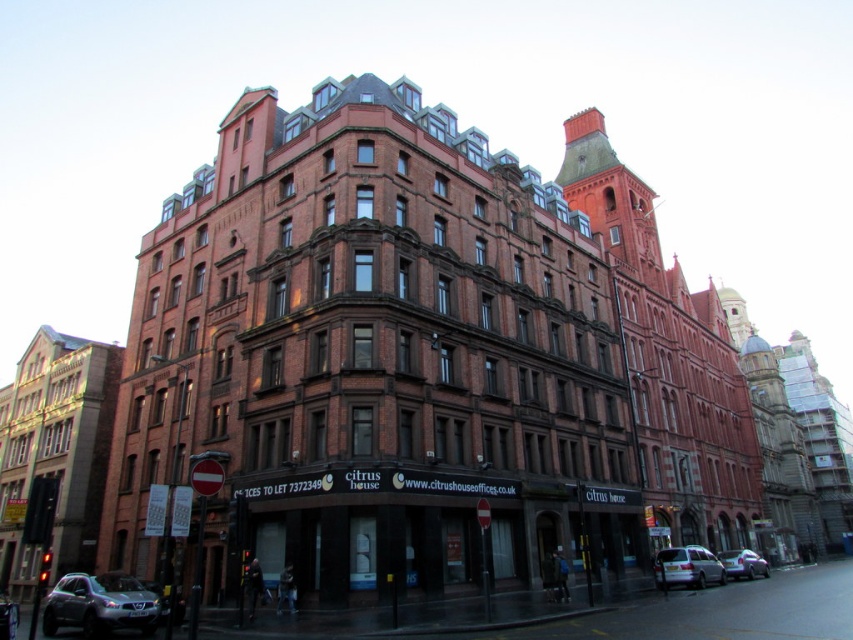
Question: Considering the relative positions of brick building at center and metallic silver car at lower right in the image provided, where is brick building at center located with respect to metallic silver car at lower right?

Choices:
 (A) right
 (B) left

Answer: (B)

Question: Can you confirm if metallic silver car at lower right is wider than metallic silver car at lower left?

Choices:
 (A) no
 (B) yes

Answer: (A)

Question: Which is farther from the brown brick building at left?

Choices:
 (A) silver metallic van at lower right
 (B) silver metallic car at lower left

Answer: (A)

Question: Which point appears closest to the camera in this image?

Choices:
 (A) (755, 554)
 (B) (10, 625)

Answer: (B)

Question: Can you confirm if brown brick building at left is positioned to the left of metallic silver car at lower left?

Choices:
 (A) no
 (B) yes

Answer: (B)

Question: Estimate the real-world distances between objects in this image. Which object is farther from the brown brick building at left?

Choices:
 (A) metallic silver car at lower left
 (B) brick building at center
 (C) metallic silver car at lower right
 (D) silver metallic van at lower right

Answer: (C)